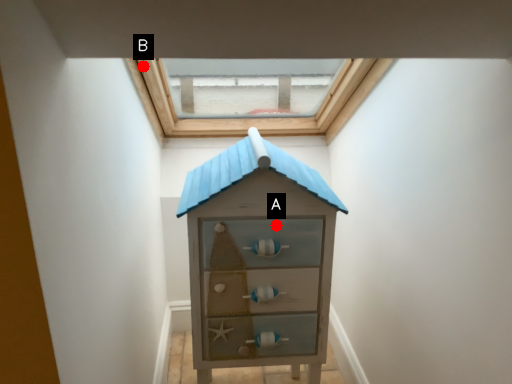
Question: Two points are circled on the image, labeled by A and B beside each circle. Which point is closer to the camera taking this photo?

Choices:
 (A) A is closer
 (B) B is closer

Answer: (A)